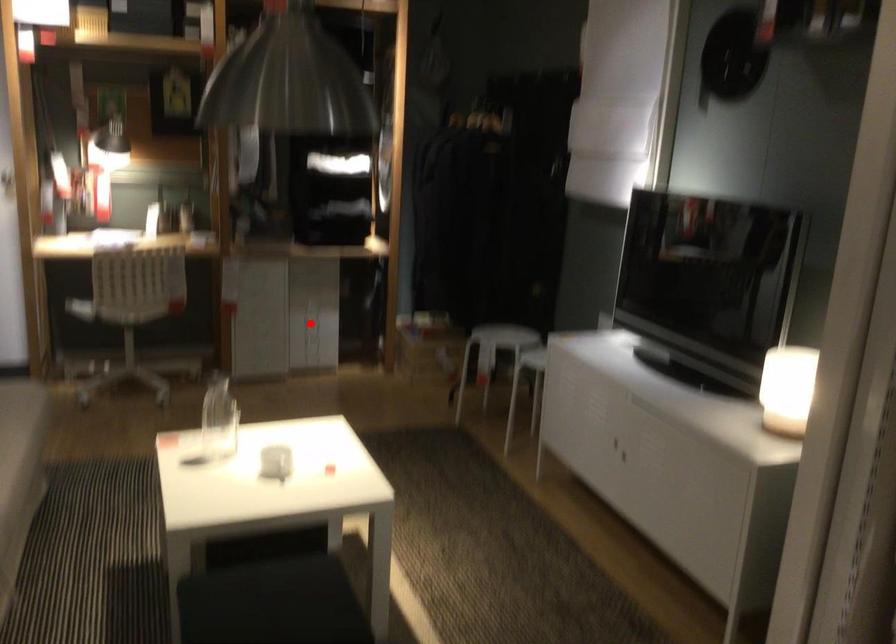
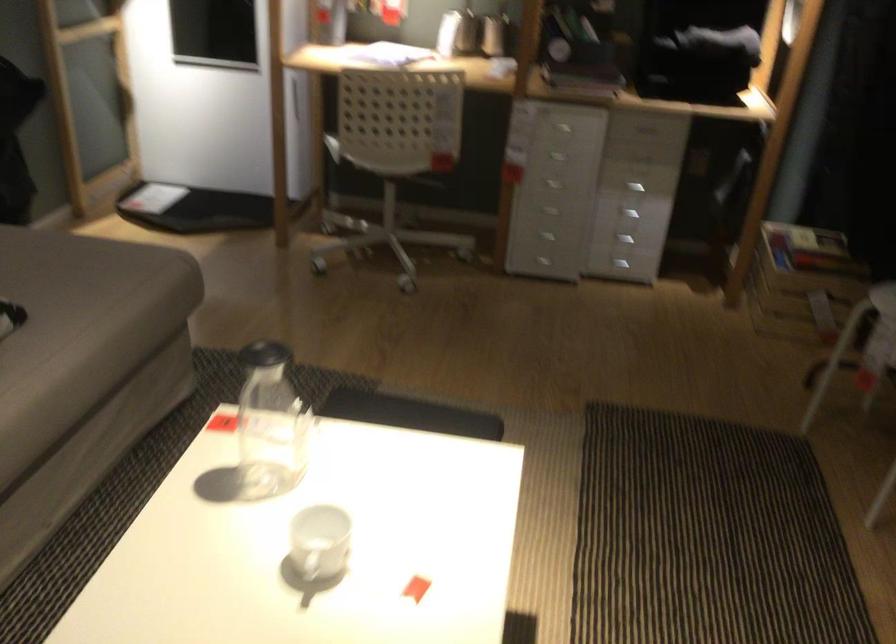
Question: I am providing you with two images of the same scene from different viewpoints. Given a red point in image1, look at the same physical point in image2. Is it:

Choices:
 (A) Closer to the viewpoint
 (B) Farther from the viewpoint

Answer: (A)